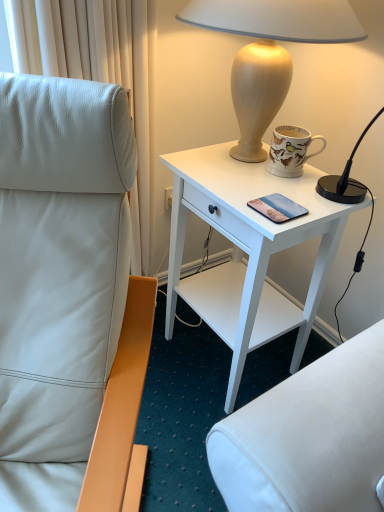
The height and width of the screenshot is (512, 384). What are the coordinates of `empty space that is ontop of white wood desk at upper right` in the screenshot? It's located at (268, 180).